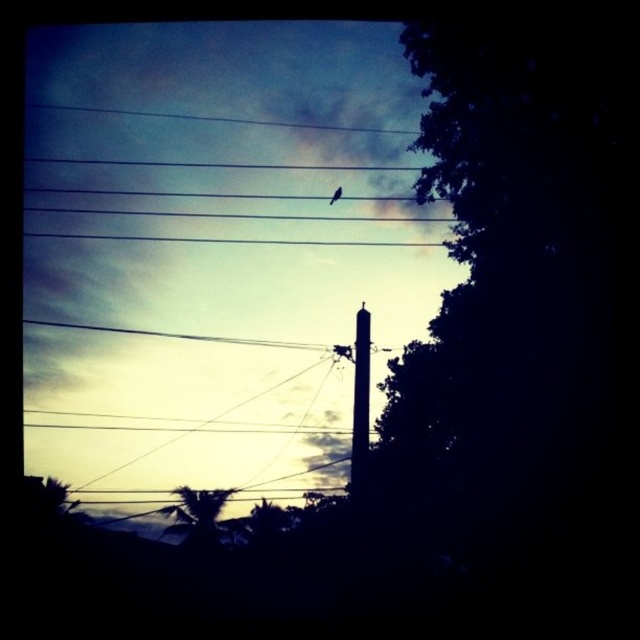
You are an ornithologist observing the scene. You need to determine the relative positions of the dark green leafy tree at right and the black matte bird at upper center. Which object is nearer to you?

The dark green leafy tree at right is closer to the viewer than the black matte bird at upper center.

You are an artist sketching the scene. You need to decide which object to draw first based on their size. Which one should you start with, the dark green leafy tree at right or the smooth concrete pole at center?

The dark green leafy tree at right is bigger than the smooth concrete pole at center, so you should start with the dark green leafy tree at right as it requires more detailed work due to its larger size.

You are a painter standing in the middle of the scene and want to paint the dark green leafy tree at right and the smooth concrete pole at center. Which object should you look towards if you want to paint the one that is farther to the east?

The dark green leafy tree at right is to the right of smooth concrete pole at center. Since the pole is at the center and the tree is to its right, if you are facing the scene, the tree would be more to the east if the scene is oriented with right as east. However, without knowing the actual orientation, we can infer based on typical landscape orientations where right might correspond to east. Thus, the dark green leafy tree at right is farther to the east compared to the smooth concrete pole at center.